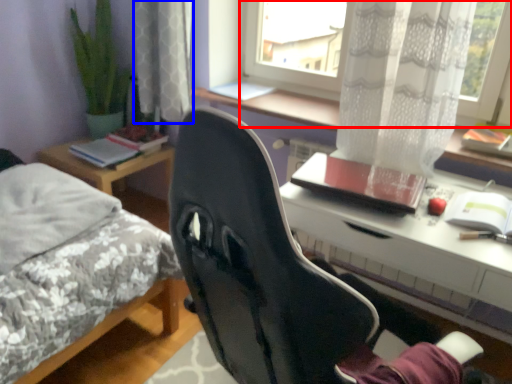
Question: Which of the following is the farthest to the observer, window (highlighted by a red box) or curtain (highlighted by a blue box)?

Choices:
 (A) window
 (B) curtain

Answer: (B)